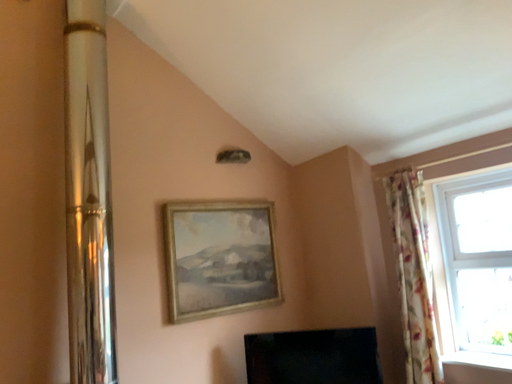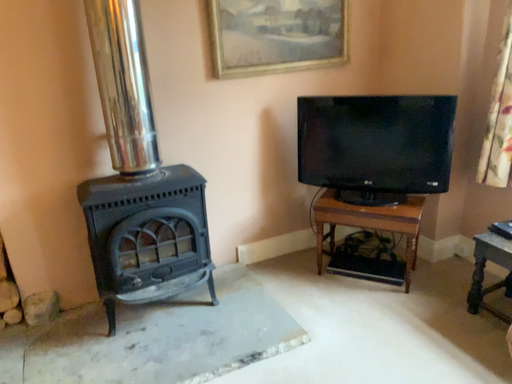
Question: How did the camera likely rotate when shooting the video?

Choices:
 (A) rotated upward
 (B) rotated downward

Answer: (B)